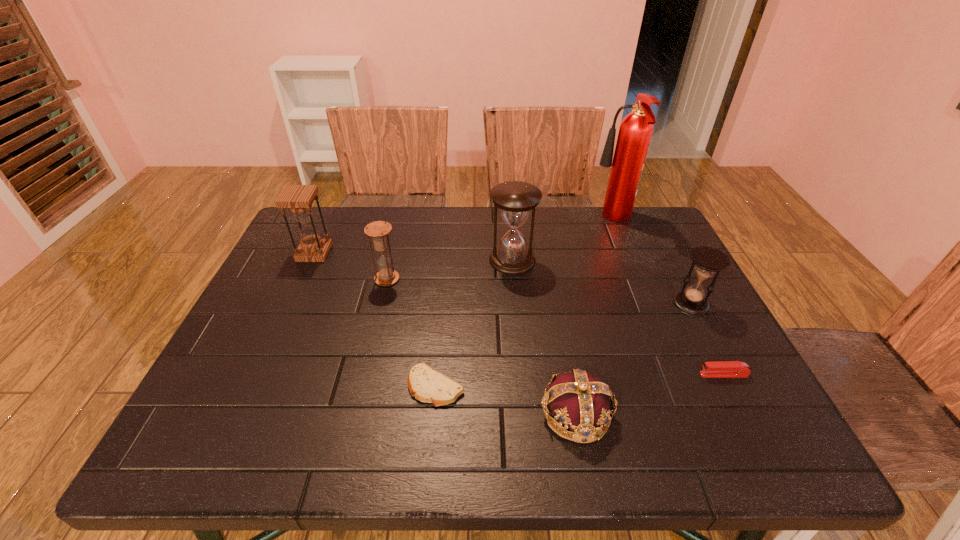
Locate an element on the screen. The width and height of the screenshot is (960, 540). object that is at the far right corner is located at coordinates (635, 131).

The height and width of the screenshot is (540, 960). Identify the location of vacant area at the far edge. (401, 219).

At what (x,y) coordinates should I click in order to perform the action: click on vacant space at the near edge of the desktop. Please return your answer as a coordinate pair (x, y). The image size is (960, 540). Looking at the image, I should click on (x=307, y=449).

In the image, there is a desktop. Where is `vacant space at the right edge`? The height and width of the screenshot is (540, 960). vacant space at the right edge is located at coordinates (665, 258).

Image resolution: width=960 pixels, height=540 pixels. Identify the location of free space at the far left corner of the desktop. (336, 241).

Where is `free region at the near left corner of the desktop`? free region at the near left corner of the desktop is located at coordinates (252, 446).

In the image, there is a desktop. Identify the location of vacant space at the far right corner. The image size is (960, 540). (616, 225).

This screenshot has width=960, height=540. In the image, there is a desktop. In order to click on vacant space at the near right corner in this screenshot , I will do `click(728, 419)`.

The image size is (960, 540). In order to click on vacant area between the third hourglass from right to left and the crown in this screenshot , I will do (482, 347).

I want to click on free space between the crown and the leftmost object, so click(x=445, y=333).